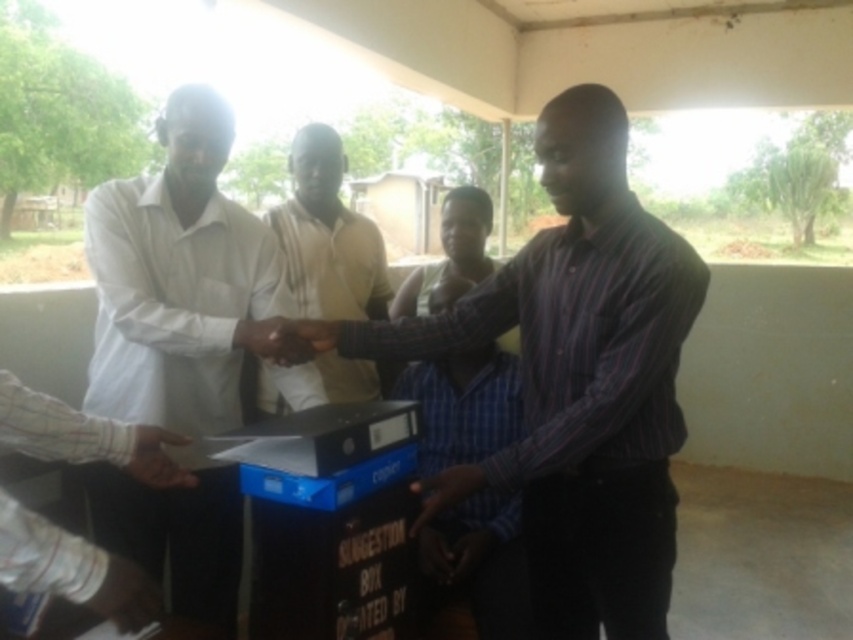
You are an observer standing in front of the scene. You notice the light brown fabric shirt at center and the matte black hand at lower left. Which object is taller?

The light brown fabric shirt at center is taller than the matte black hand at lower left.

You are organizing a photo shoot and need to ensure that the matte black shirt at center and the matte black hand at lower left are visible in the frame. Given that the camera has a fixed focal length, which object should you prioritize keeping closer to the lens to ensure visibility?

The matte black shirt at center should be prioritized closer to the lens because its width is larger than the matte black hand at lower left, making it more likely to require a closer focus for clarity.

You are a photographer at the event and want to capture a photo where the light brown fabric shirt at center is clearly visible without being covered by the matte black hand at lower left. Based on their current positions, is this possible?

The light brown fabric shirt at center is positioned over the matte black hand at lower left, so the hand is already beneath the shirt, meaning the shirt is not obstructed by the hand. Therefore, the photographer can capture the light brown fabric shirt at center clearly without any obstruction from the matte black hand at lower left.